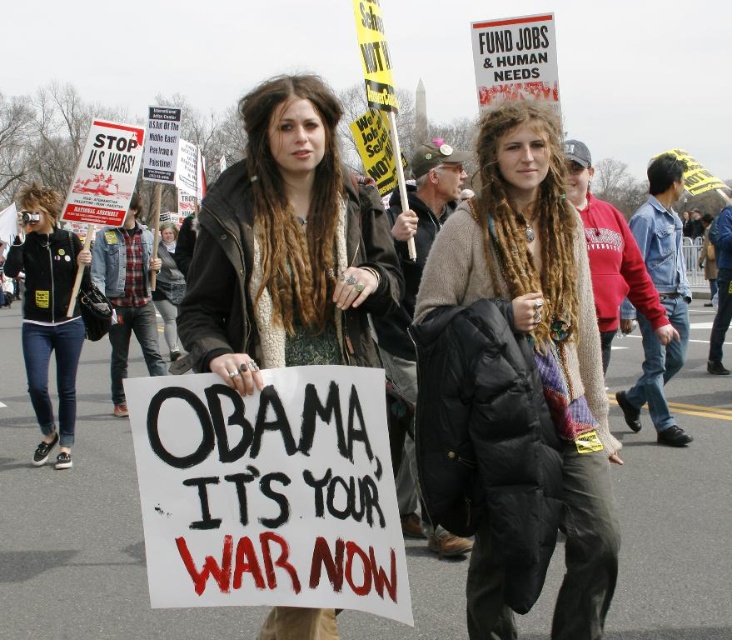
Question: Which object is the closest to the matte black jacket at center?

Choices:
 (A) knitted sweater at center
 (B) black leather jacket at left

Answer: (A)

Question: Is knitted sweater at center to the right of black leather jacket at left from the viewer's perspective?

Choices:
 (A) yes
 (B) no

Answer: (A)

Question: Where is knitted sweater at center located in relation to black leather jacket at left in the image?

Choices:
 (A) below
 (B) above

Answer: (B)

Question: Which object is farther from the camera taking this photo?

Choices:
 (A) knitted sweater at center
 (B) matte black jacket at center
 (C) black leather jacket at left

Answer: (C)

Question: Which point appears closest to the camera in this image?

Choices:
 (A) (29, 305)
 (B) (317, 337)

Answer: (B)

Question: Can you confirm if matte black jacket at center is positioned to the left of black leather jacket at left?

Choices:
 (A) yes
 (B) no

Answer: (B)